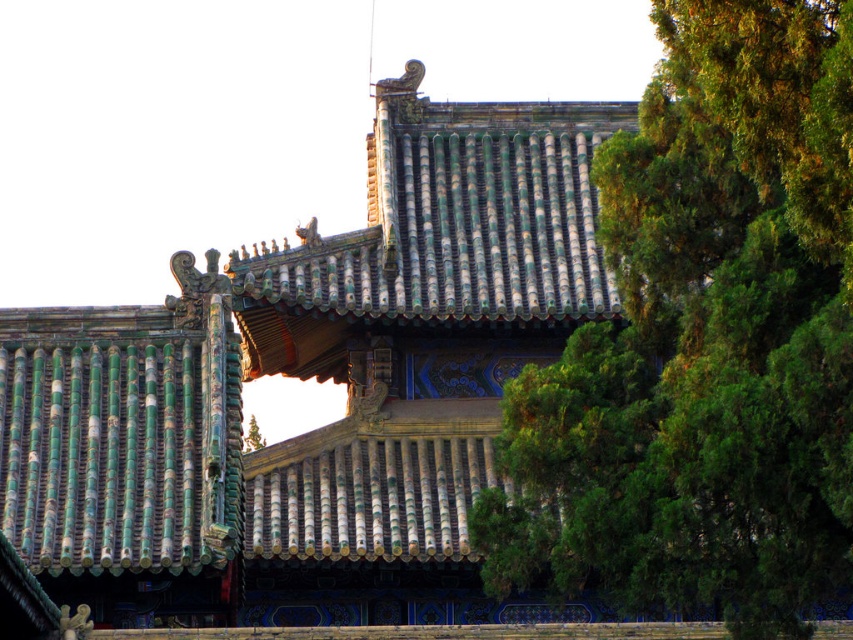
Question: Is green glazed tiles at center behind green leafy tree at upper right?

Choices:
 (A) yes
 (B) no

Answer: (A)

Question: Is green glazed tiles at center closer to the viewer compared to green leafy tree at upper right?

Choices:
 (A) yes
 (B) no

Answer: (B)

Question: Among these points, which one is farthest from the camera?

Choices:
 (A) (262, 480)
 (B) (605, 209)

Answer: (A)

Question: Which of the following is the closest to the observer?

Choices:
 (A) green glazed tiles at center
 (B) green leafy tree at upper right

Answer: (B)

Question: Where is green glazed tiles at center located in relation to green leafy tree at upper right in the image?

Choices:
 (A) below
 (B) above

Answer: (B)